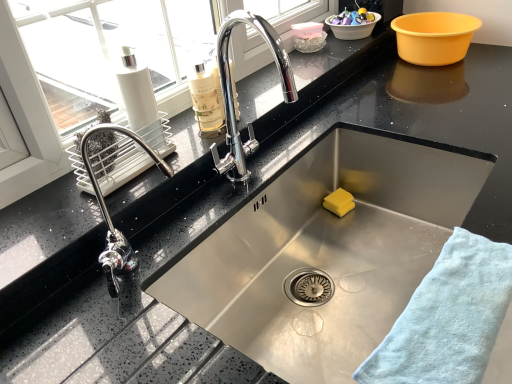
Where is `free point above light blue cotton towel at lower right (from a real-world perspective)`? Image resolution: width=512 pixels, height=384 pixels. free point above light blue cotton towel at lower right (from a real-world perspective) is located at coordinates (444, 319).